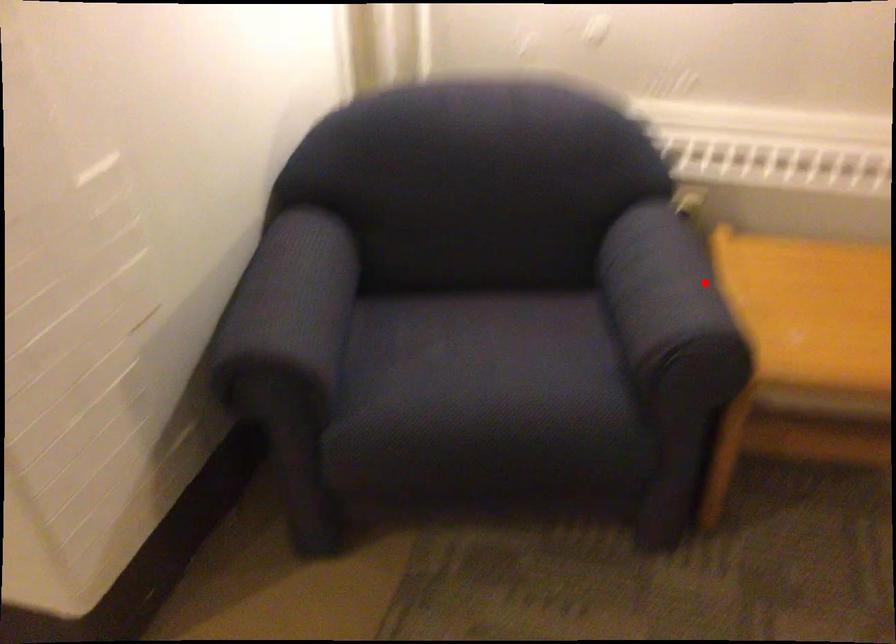
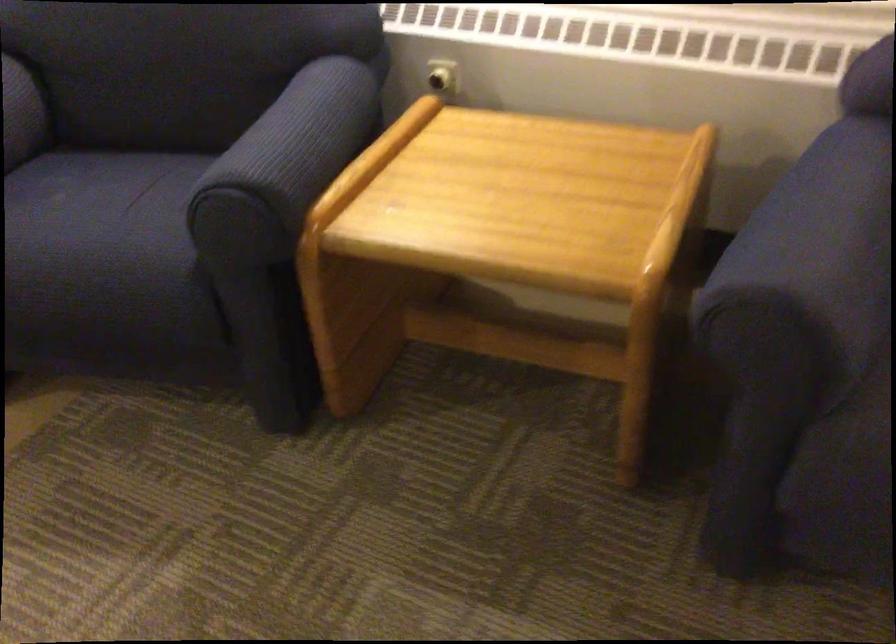
The point at the highlighted location is marked in the first image. Where is the corresponding point in the second image?

(295, 144)